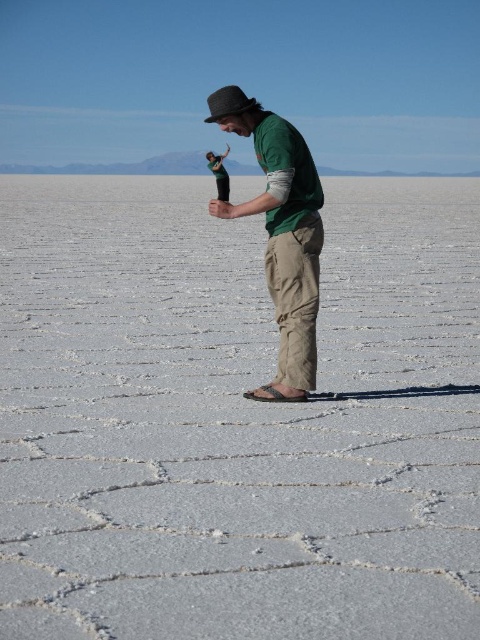
Question: Which point is closer to the camera taking this photo?

Choices:
 (A) (296, 323)
 (B) (28, 474)

Answer: (B)

Question: Does matte black bottle at center lie in front of green cotton shirt at center?

Choices:
 (A) yes
 (B) no

Answer: (A)

Question: Does matte black bottle at center lie behind green cotton shirt at center?

Choices:
 (A) yes
 (B) no

Answer: (B)

Question: Among these points, which one is nearest to the camera?

Choices:
 (A) (252, 397)
 (B) (358, 621)

Answer: (B)

Question: In this image, where is matte black bottle at center located relative to green cotton shirt at center?

Choices:
 (A) left
 (B) right

Answer: (A)